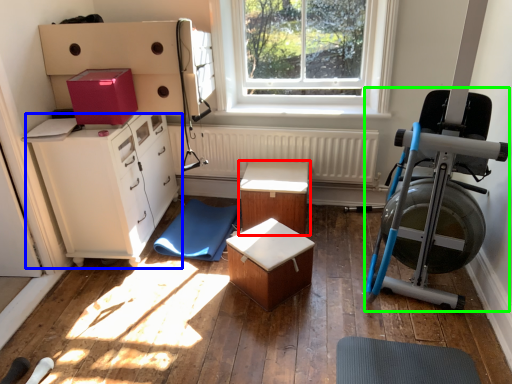
Question: Considering the real-world distances, which object is closest to table (highlighted by a red box)? chest of drawers (highlighted by a blue box) or baby carriage (highlighted by a green box).

Choices:
 (A) chest of drawers
 (B) baby carriage

Answer: (A)